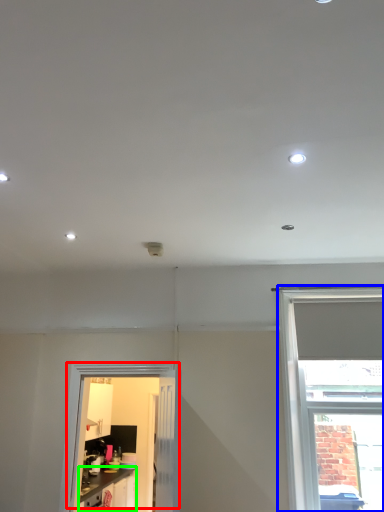
Question: Which object is positioned farthest from door (highlighted by a red box)? Select from window (highlighted by a blue box) and cabinetry (highlighted by a green box).

Choices:
 (A) window
 (B) cabinetry

Answer: (A)